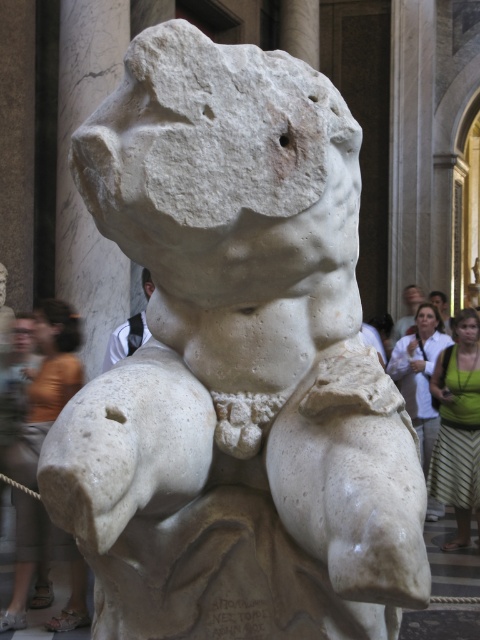
Between point (17, 625) and point (142, 285), which one is positioned in front?

Point (17, 625)

Who is more distant from viewer, (60, 371) or (134, 333)?

The point (134, 333) is more distant.

Locate an element on the screen. The width and height of the screenshot is (480, 640). orange fabric at lower left is located at coordinates (48, 385).

Does orange fabric at lower left have a lesser height compared to green fabric dress at right?

Incorrect, orange fabric at lower left's height does not fall short of green fabric dress at right's.

Is orange fabric at lower left smaller than green fabric dress at right?

Incorrect, orange fabric at lower left is not smaller in size than green fabric dress at right.

The width and height of the screenshot is (480, 640). Identify the location of orange fabric at lower left. point(48,385).

Locate an element on the screen. Image resolution: width=480 pixels, height=640 pixels. orange fabric at lower left is located at coordinates (48, 385).

Is orange fabric at lower left below light brown hair at upper center?

Yes, orange fabric at lower left is below light brown hair at upper center.

The image size is (480, 640). Find the location of `orange fabric at lower left`. orange fabric at lower left is located at coordinates (48, 385).

What do you see at coordinates (48, 385) in the screenshot? I see `orange fabric at lower left` at bounding box center [48, 385].

Where is `orange fabric at lower left`? orange fabric at lower left is located at coordinates (48, 385).